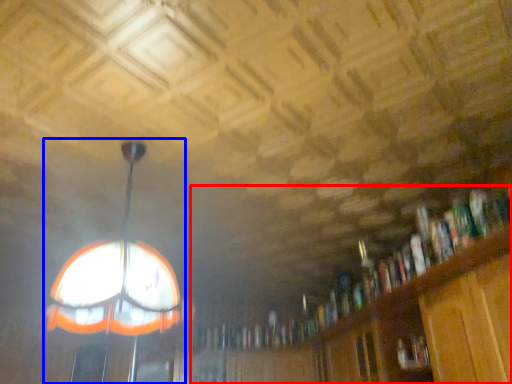
Question: Which of the following is the closest to the observer, bookcase (highlighted by a red box) or lamp (highlighted by a blue box)?

Choices:
 (A) bookcase
 (B) lamp

Answer: (A)